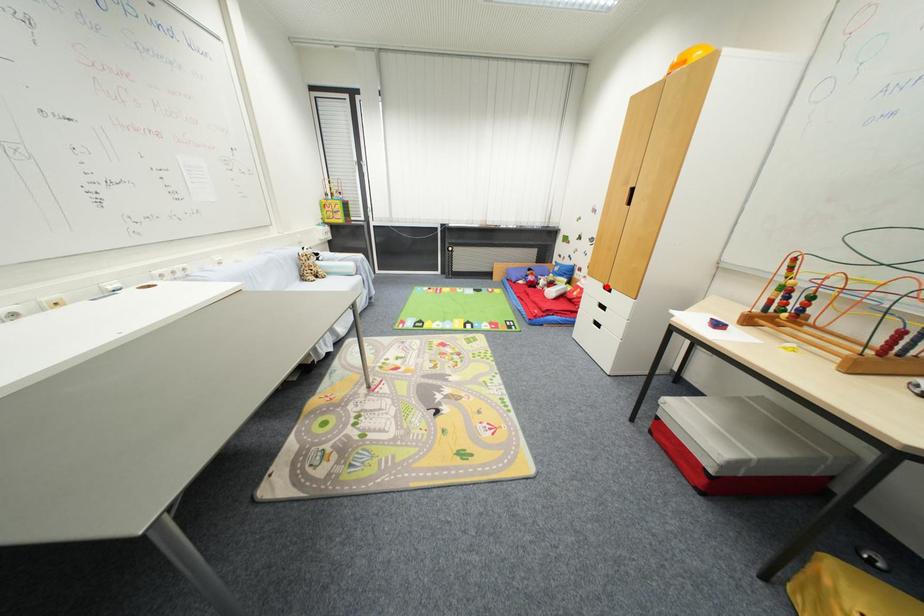
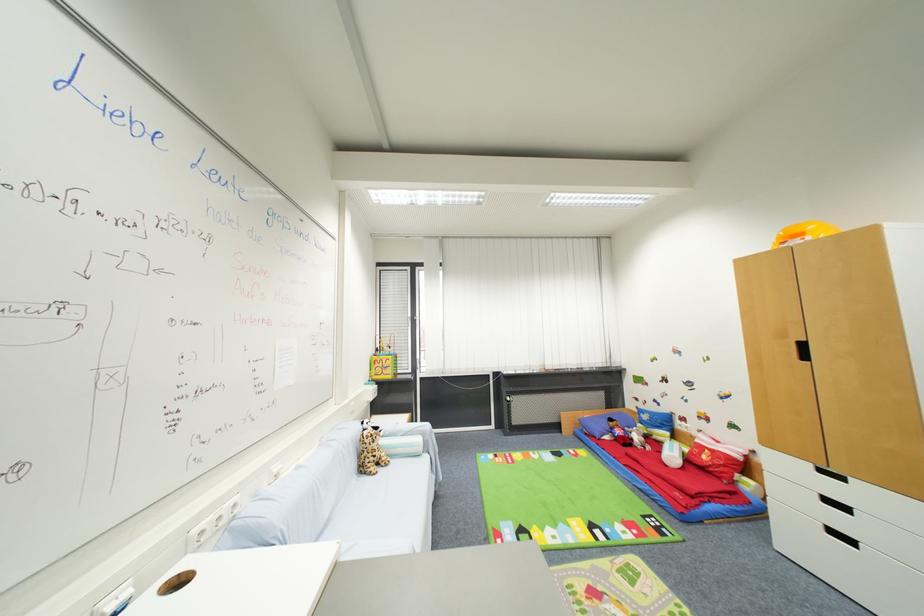
Question: I am providing you with two images of the same scene from different viewpoints. Image1 has a red point marked. In image2, the corresponding 3D location appears at what relative position? Reply with the corresponding letter.

Choices:
 (A) Closer
 (B) Farther

Answer: (B)